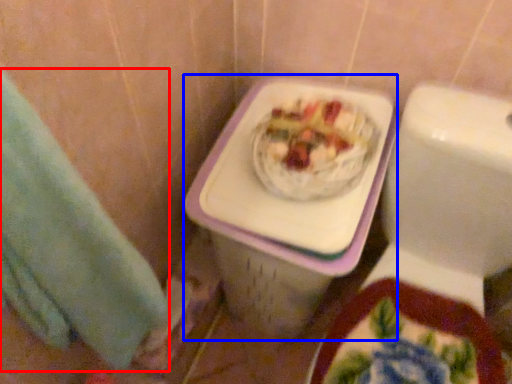
Question: Among these objects, which one is nearest to the camera, hand towel (highlighted by a red box) or porcelain (highlighted by a blue box)?

Choices:
 (A) hand towel
 (B) porcelain

Answer: (A)